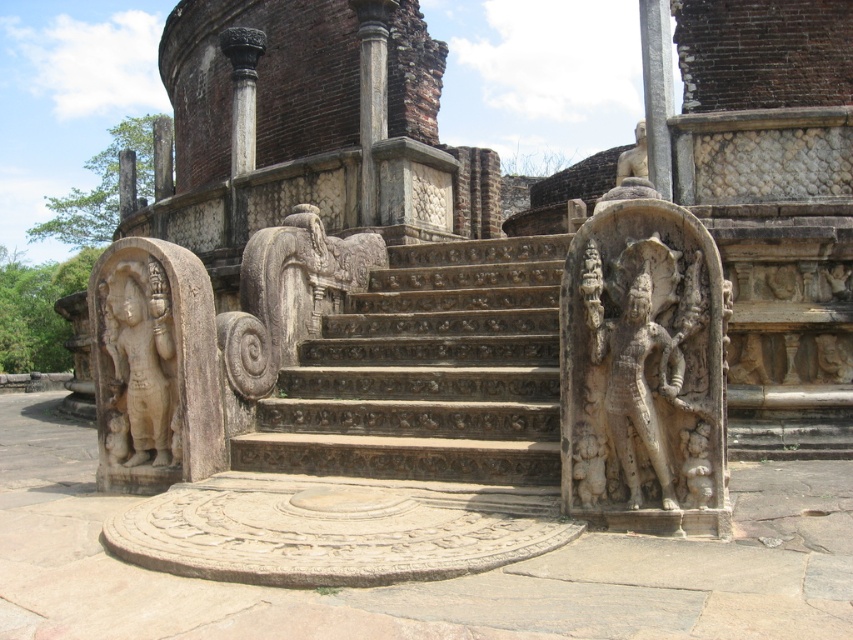
Does carved stone stairs at center come behind white stone statue at upper center?

No, it is in front of white stone statue at upper center.

Who is taller, carved stone stairs at center or white stone statue at upper center?

white stone statue at upper center

The image size is (853, 640). I want to click on carved stone stairs at center, so click(x=427, y=372).

Identify the location of carved stone stairs at center. This screenshot has width=853, height=640. (427, 372).

Is point (738, 333) farther from camera compared to point (622, 156)?

No, (738, 333) is closer to viewer.

The image size is (853, 640). I want to click on stone statues at center, so pyautogui.click(x=328, y=134).

I want to click on stone statues at center, so click(328, 134).

Can you confirm if stone statues at center is smaller than beige stone statue at left?

No, stone statues at center is not smaller than beige stone statue at left.

Locate an element on the screen. This screenshot has height=640, width=853. stone statues at center is located at coordinates (328, 134).

Find the location of a particular element. stone statues at center is located at coordinates (328, 134).